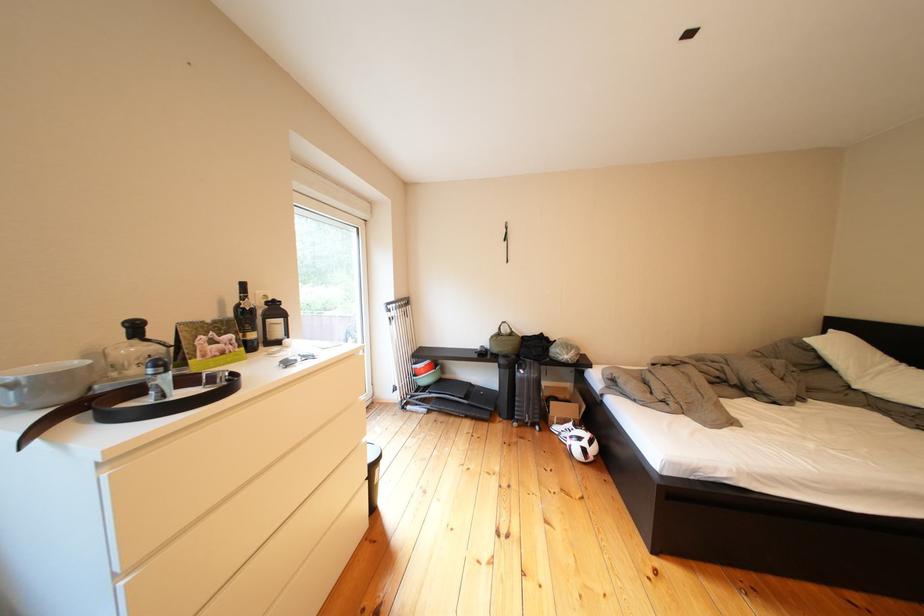
This screenshot has height=616, width=924. In order to click on the second drawer lip in this screenshot , I will do `click(271, 501)`.